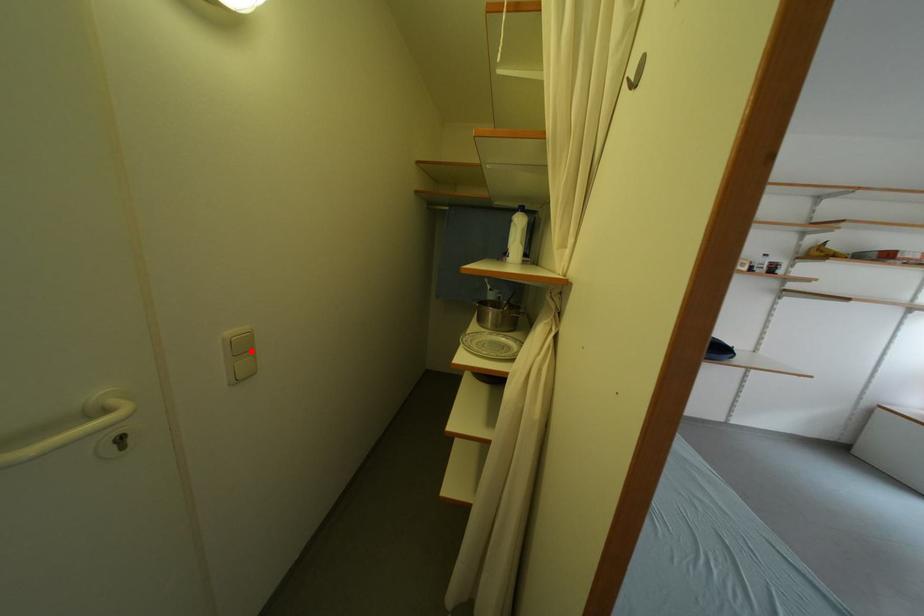
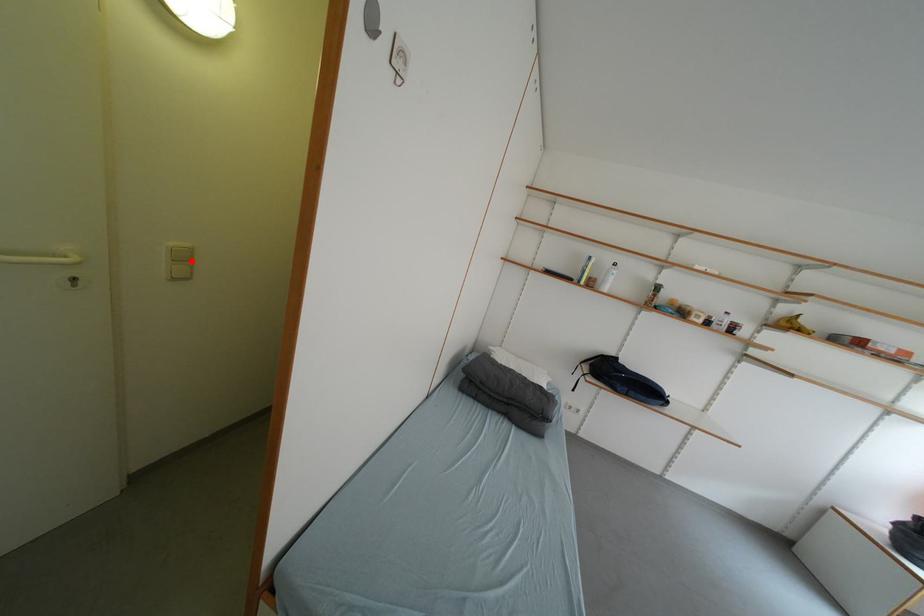
I am providing you with two images of the same scene from different viewpoints. A red point is marked on the first image and another point is marked on the second image. Is the red point in image1 aligned with the point shown in image2?

Yes